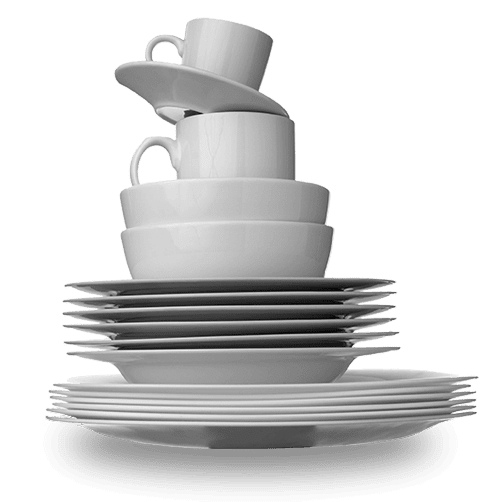
Find the location of a particular element. Image resolution: width=500 pixels, height=502 pixels. plates is located at coordinates pos(476,376), pos(466,386), pos(470,392), pos(471,399), pos(472,407), pos(472,412).